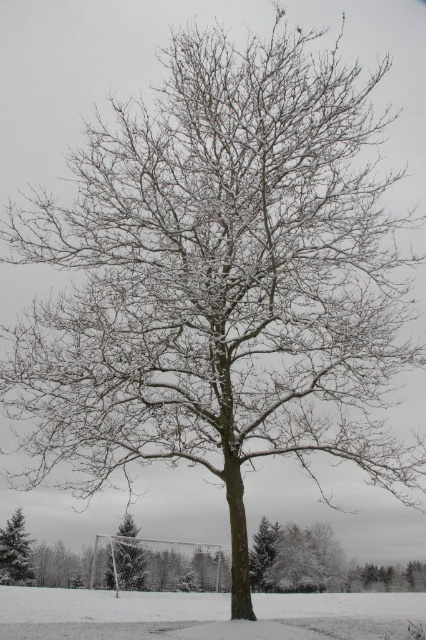
You are a photographer wanting to capture both the snowy grass at center and the white frosty tree at lower center in a single frame. Based on their sizes, which object should you focus on to ensure both fit well in the photo?

The snowy grass at center is smaller in size compared to the white frosty tree at lower center. To ensure both fit well in the photo, focus on the white frosty tree at lower center as it is larger and will require more space in the frame.